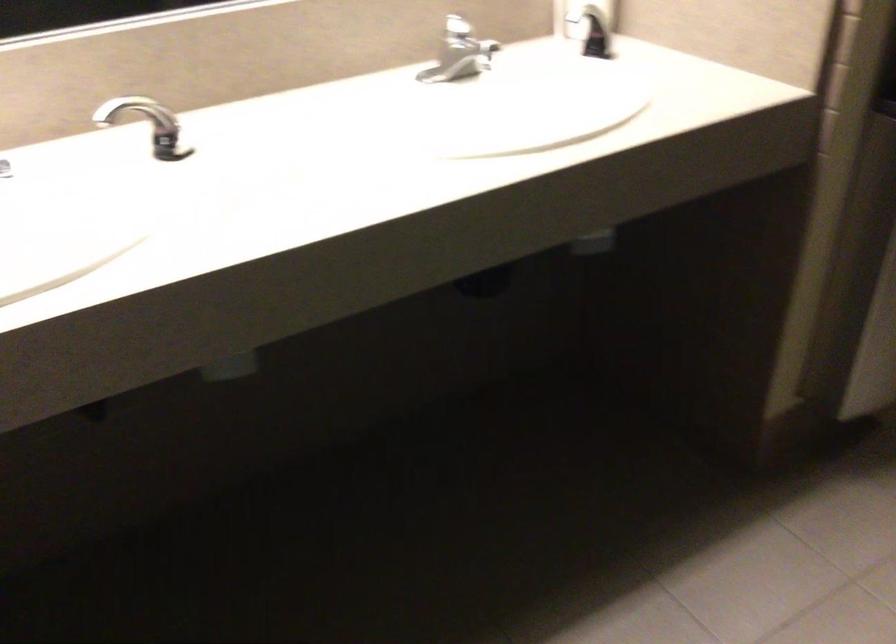
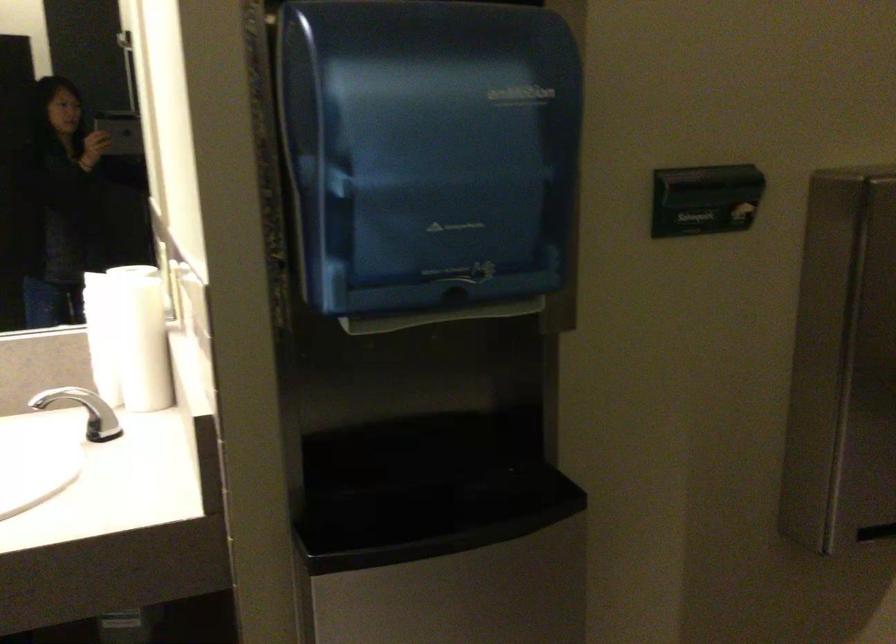
Question: In a continuous first-person perspective shot, in which direction is the camera moving?

Choices:
 (A) Left
 (B) Right
 (C) Forward
 (D) Backward

Answer: (B)